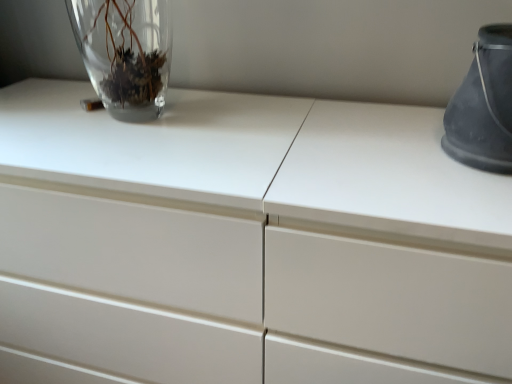
Question: Considering their positions, is matte gray bucket at right, marked as the 2th vase in a left-to-right arrangement, located in front of or behind transparent glass vase at upper left, which is counted as the 2th vase, starting from the right?

Choices:
 (A) behind
 (B) front

Answer: (B)

Question: Is matte gray bucket at right, placed as the first vase when sorted from right to left, to the left or to the right of transparent glass vase at upper left, marked as the 1th vase in a left-to-right arrangement, in the image?

Choices:
 (A) right
 (B) left

Answer: (A)

Question: Does point pos(456,104) appear closer or farther from the camera than point pos(154,94)?

Choices:
 (A) closer
 (B) farther

Answer: (A)

Question: Visually, is transparent glass vase at upper left, marked as the 1th vase in a left-to-right arrangement, positioned to the left or to the right of matte gray bucket at right, placed as the first vase when sorted from right to left?

Choices:
 (A) left
 (B) right

Answer: (A)

Question: From their relative heights in the image, would you say transparent glass vase at upper left, marked as the 1th vase in a left-to-right arrangement, is taller or shorter than matte gray bucket at right, marked as the 2th vase in a left-to-right arrangement?

Choices:
 (A) tall
 (B) short

Answer: (A)

Question: Looking at their shapes, would you say transparent glass vase at upper left, which is counted as the 2th vase, starting from the right, is wider or thinner than matte gray bucket at right, marked as the 2th vase in a left-to-right arrangement?

Choices:
 (A) wide
 (B) thin

Answer: (B)

Question: From a real-world perspective, is transparent glass vase at upper left, marked as the 1th vase in a left-to-right arrangement, positioned above or below matte gray bucket at right, placed as the first vase when sorted from right to left?

Choices:
 (A) above
 (B) below

Answer: (A)